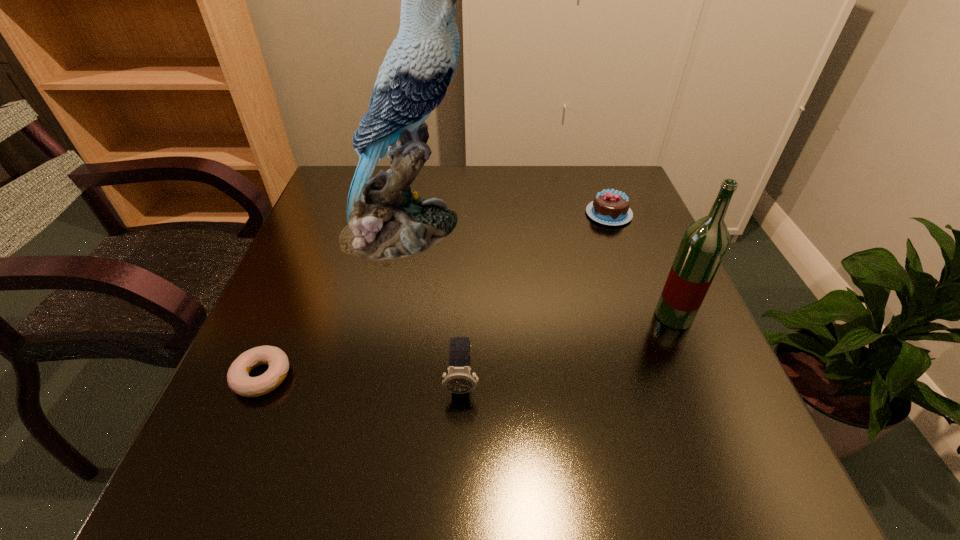
The height and width of the screenshot is (540, 960). In order to click on free space between the parakeet and the watch in this screenshot , I will do `click(433, 305)`.

I want to click on vacant region between the doughnut and the watch, so click(x=362, y=379).

Identify the location of empty space that is in between the doughnut and the chocolate cake. The width and height of the screenshot is (960, 540). (436, 295).

You are a GUI agent. You are given a task and a screenshot of the screen. Output one action in this format:
    pyautogui.click(x=<x>, y=<y>)
    Task: Click on the free area in between the doughnut and the third tallest object
    The height and width of the screenshot is (540, 960).
    Given the screenshot: What is the action you would take?
    pyautogui.click(x=362, y=379)

Locate an element on the screen. The height and width of the screenshot is (540, 960). free space that is in between the parakeet and the third nearest object is located at coordinates (539, 273).

I want to click on empty space between the tallest object and the chocolate cake, so click(x=507, y=221).

You are a GUI agent. You are given a task and a screenshot of the screen. Output one action in this format:
    pyautogui.click(x=<x>, y=<y>)
    Task: Click on the free space between the parakeet and the third tallest object
    
    Given the screenshot: What is the action you would take?
    pyautogui.click(x=433, y=305)

Select which object is the closest to the second shortest object. Please provide its 2D coordinates. Your answer should be formatted as a tuple, i.e. [(x, y)], where the tuple contains the x and y coordinates of a point satisfying the conditions above.

[(704, 244)]

Locate which object ranks third in proximity to the second shortest object. Please provide its 2D coordinates. Your answer should be formatted as a tuple, i.e. [(x, y)], where the tuple contains the x and y coordinates of a point satisfying the conditions above.

[(459, 379)]

Locate an element on the screen. vacant area in the image that satisfies the following two spatial constraints: 1. on the face of the parakeet; 2. on the right side of the liquor is located at coordinates (386, 316).